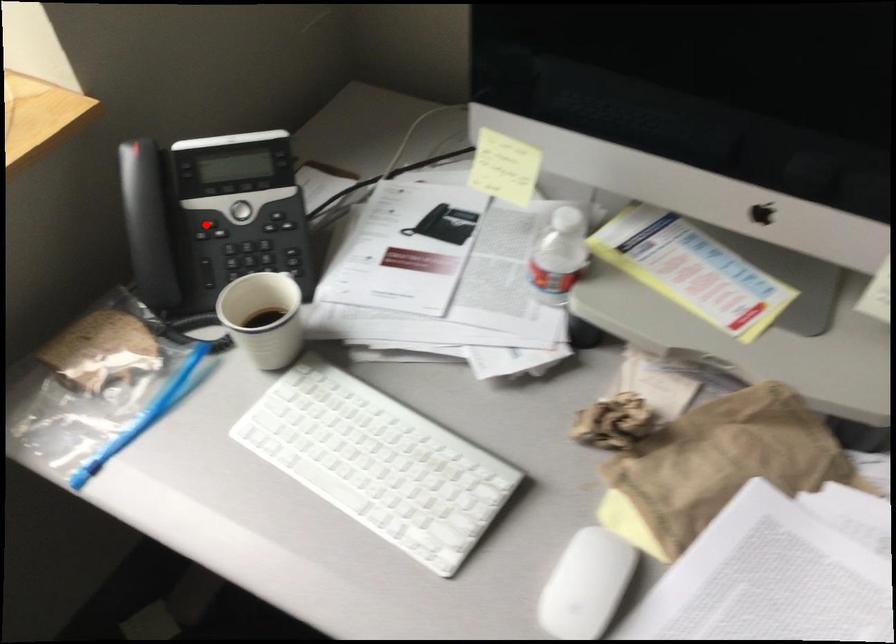
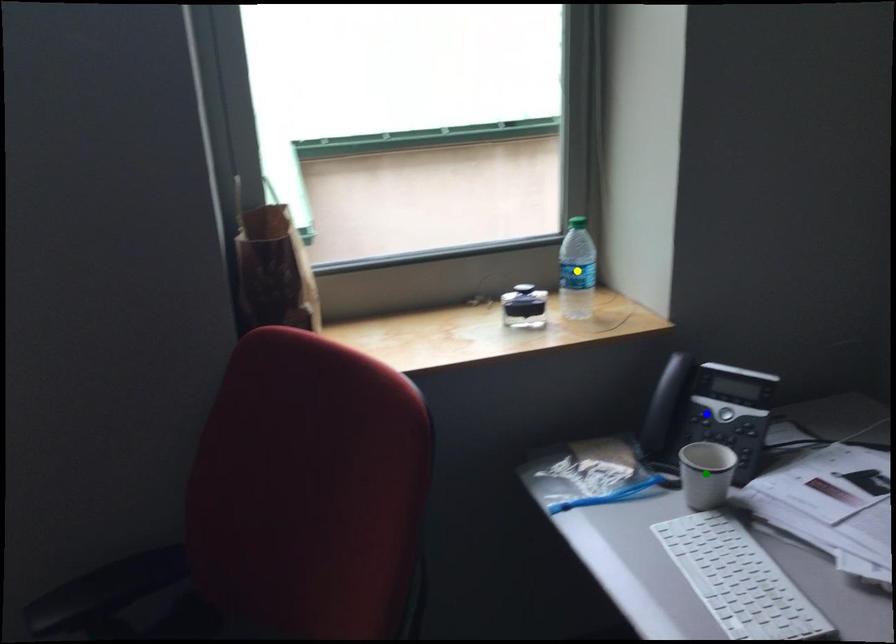
Question: I am providing you with two images of the same scene from different viewpoints. A red point is marked on the first image. You are given multiple points on the second image. Which point in image 2 represents the same 3d spot as the red point in image 1?

Choices:
 (A) green point
 (B) yellow point
 (C) blue point

Answer: (C)